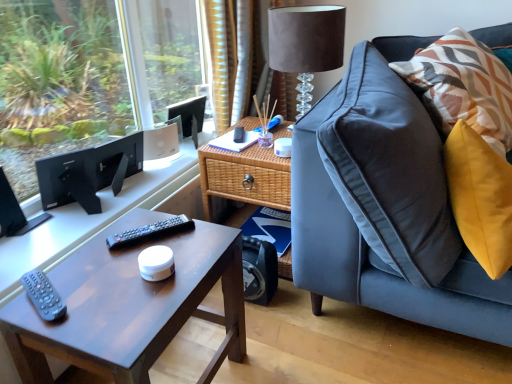
Identify the location of vacant region to the right of black plastic remote at center, which appears as the 2th remote when viewed from the front. Image resolution: width=512 pixels, height=384 pixels. (197, 241).